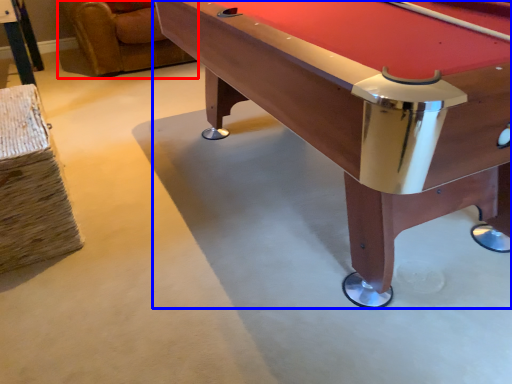
Question: Among these objects, which one is farthest to the camera, swivel chair (highlighted by a red box) or billiard table (highlighted by a blue box)?

Choices:
 (A) swivel chair
 (B) billiard table

Answer: (A)